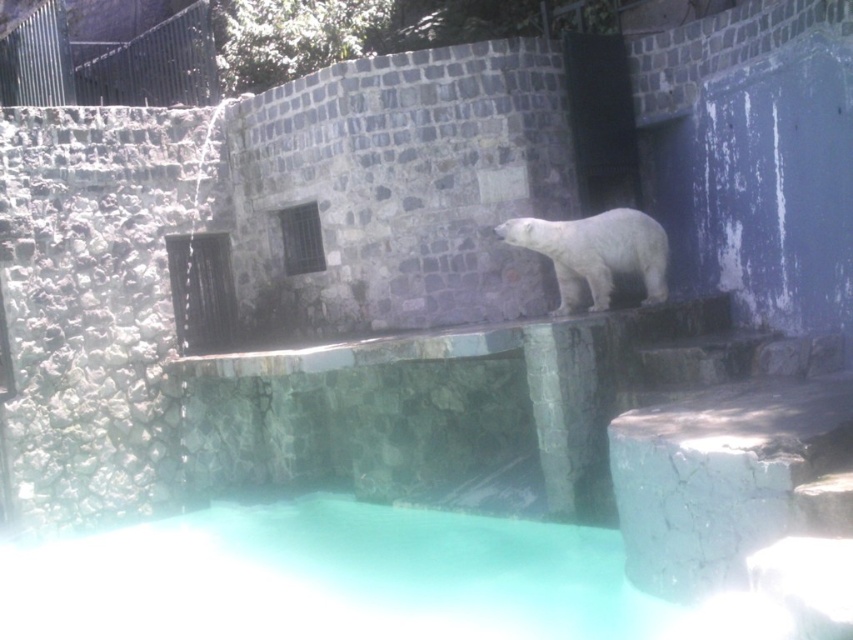
You are a zookeeper planning to place a new feeding tray for the white fur bear at center. The tray requires a platform that is taller than the smooth concrete ledge at center. Based on the scene, where could you place the feeding tray?

The white fur bear at center is taller than the smooth concrete ledge at center, so placing the feeding tray on the bear itself or on a higher structure not mentioned in the scene would be necessary. However, since the scene only mentions the ledge and the bear, the feeding tray cannot be placed on any object in the scene as the bear is taller than the ledge but the tray needs to be taller than the ledge. Alternatively, the zookeeper might need to construct a new platform.

You are a zookeeper preparing to feed the white fur bear at center. You have a bucket of fish placed on the smooth concrete ledge at center. Considering the size of the ledge, will you be able to comfortably place the bucket there without it falling off?

The smooth concrete ledge at center has a smaller size compared to white fur bear at center. Since the ledge is smaller, placing the bucket there might be risky as there may not be enough space to securely hold the bucket without it tipping over. It would be safer to find a larger, more stable surface.